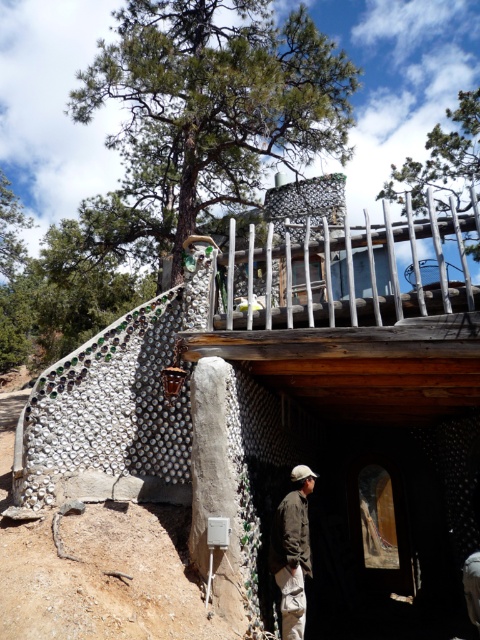
Can you confirm if bottle mosaic hut at upper center is positioned below brown fabric jacket at lower center?

No.

Between bottle mosaic hut at upper center and brown fabric jacket at lower center, which one has more height?

bottle mosaic hut at upper center is taller.

Does point (310, 189) lie behind point (308, 561)?

Yes, it is behind point (308, 561).

Where is `bottle mosaic hut at upper center`? The height and width of the screenshot is (640, 480). bottle mosaic hut at upper center is located at coordinates (358, 394).